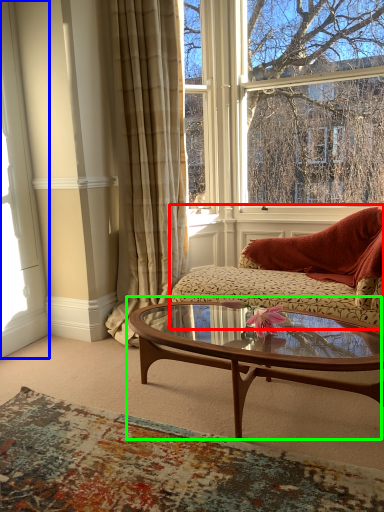
Question: Based on their relative distances, which object is farther from studio couch (highlighted by a red box)? Choose from window frame (highlighted by a blue box) and coffee table (highlighted by a green box).

Choices:
 (A) window frame
 (B) coffee table

Answer: (A)